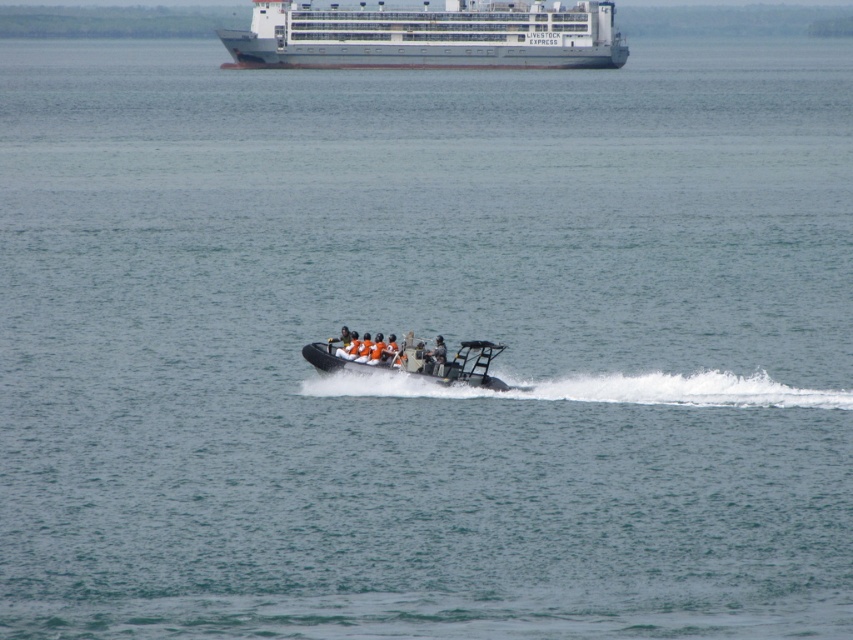
Which of these two, white matte cruise ship at upper center or orange life vest at center, stands taller?

white matte cruise ship at upper center

Who is more forward, (489, 19) or (339, 356)?

Point (339, 356) is in front.

Does point (415, 29) lie behind point (344, 346)?

Yes, it is behind point (344, 346).

Where is `white matte cruise ship at upper center`? The image size is (853, 640). white matte cruise ship at upper center is located at coordinates (427, 36).

Is white matte cruise ship at upper center smaller than orange fabric boat at center?

No.

Is white matte cruise ship at upper center to the left of orange fabric boat at center from the viewer's perspective?

Correct, you'll find white matte cruise ship at upper center to the left of orange fabric boat at center.

Who is more distant from viewer, (340, 36) or (387, 368)?

Point (340, 36)

Image resolution: width=853 pixels, height=640 pixels. Identify the location of white matte cruise ship at upper center. (427, 36).

Is the position of orange fabric boat at center more distant than that of orange life vest at center?

No, it is not.

The image size is (853, 640). What do you see at coordinates (415, 362) in the screenshot?
I see `orange fabric boat at center` at bounding box center [415, 362].

The image size is (853, 640). Identify the location of orange fabric boat at center. (415, 362).